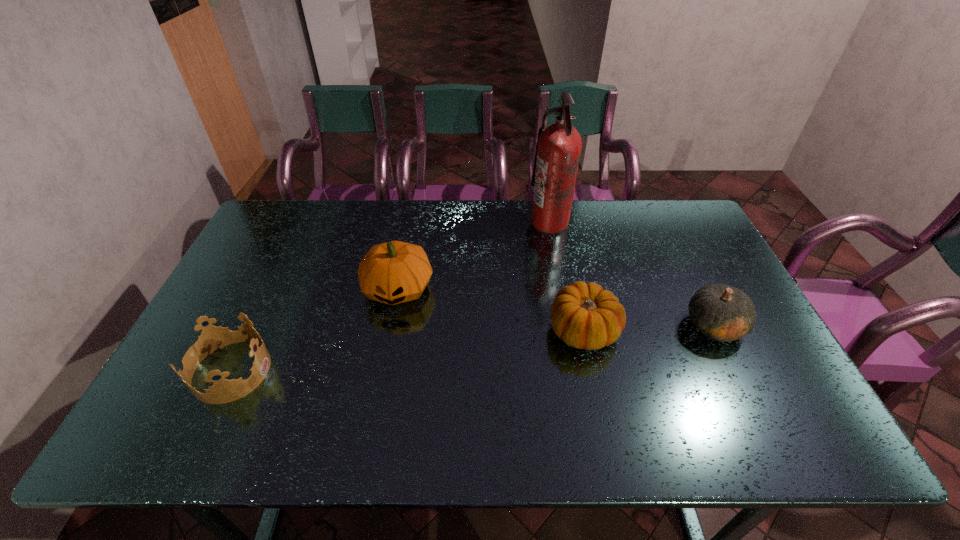
Identify the location of fire extinguisher. (558, 149).

What are the coordinates of `the tallest object` in the screenshot? It's located at (558, 149).

At what (x,y) coordinates should I click in order to perform the action: click on the second object from left to right. Please return your answer as a coordinate pair (x, y). The width and height of the screenshot is (960, 540). Looking at the image, I should click on (394, 272).

Where is `the leftmost gourd`? The image size is (960, 540). the leftmost gourd is located at coordinates (394, 272).

Locate an element on the screen. This screenshot has height=540, width=960. the rightmost gourd is located at coordinates (721, 312).

At what (x,y) coordinates should I click in order to perform the action: click on the leftmost object. Please return your answer as a coordinate pair (x, y). The width and height of the screenshot is (960, 540). Looking at the image, I should click on coord(212,338).

This screenshot has height=540, width=960. What are the coordinates of `the second gourd from left to right` in the screenshot? It's located at (584, 316).

The width and height of the screenshot is (960, 540). What are the coordinates of `vacant space located on the front of the tallest object near the operation label` in the screenshot? It's located at (493, 222).

Where is `vacant area situated 0.330m on the front of the tallest object near the operation label`? The width and height of the screenshot is (960, 540). vacant area situated 0.330m on the front of the tallest object near the operation label is located at coordinates (436, 222).

Locate an element on the screen. free space located on the front of the tallest object near the operation label is located at coordinates (x=453, y=222).